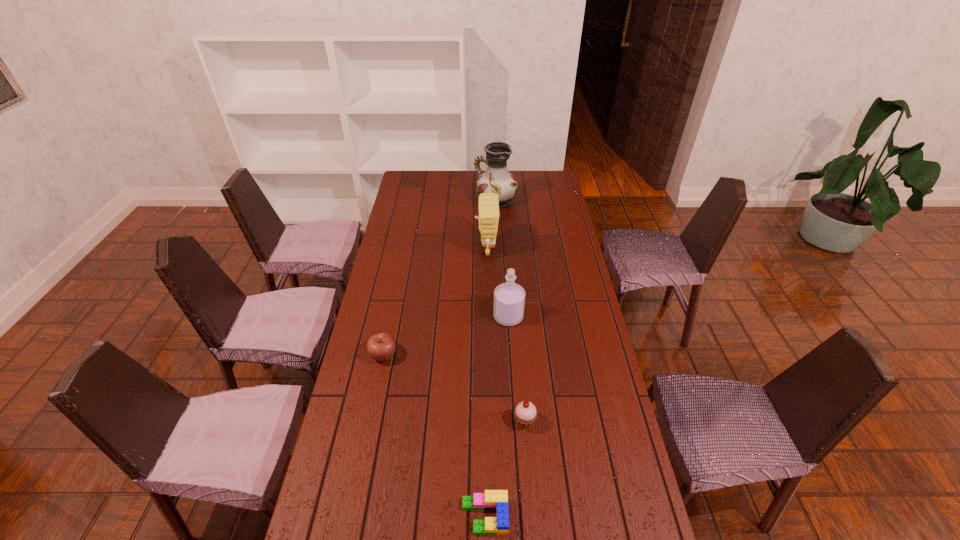
Locate an element on the screen. vacant space at the left edge of the desktop is located at coordinates (411, 223).

Where is `free space at the right edge of the desktop`? This screenshot has height=540, width=960. free space at the right edge of the desktop is located at coordinates (596, 430).

This screenshot has height=540, width=960. I want to click on vacant space at the far left corner of the desktop, so [x=417, y=172].

Identify the location of empty space between the cupcake and the apple. (454, 388).

Where is `free space that is in between the nearest object and the vase`? free space that is in between the nearest object and the vase is located at coordinates (491, 359).

I want to click on vacant area that lies between the Lego and the perfume, so click(x=496, y=416).

The height and width of the screenshot is (540, 960). In order to click on blank region between the fifth farthest object and the fourth farthest object in this screenshot , I will do `click(454, 388)`.

Where is `vacant space that is in between the fifth tallest object and the fourth tallest object`? vacant space that is in between the fifth tallest object and the fourth tallest object is located at coordinates (454, 388).

The height and width of the screenshot is (540, 960). I want to click on empty space that is in between the fifth tallest object and the shortest object, so pos(434,436).

You are a GUI agent. You are given a task and a screenshot of the screen. Output one action in this format:
    pyautogui.click(x=<x>, y=<y>)
    Task: Click on the unoccupied area between the Lego and the fourth tallest object
    
    Given the screenshot: What is the action you would take?
    pyautogui.click(x=505, y=469)